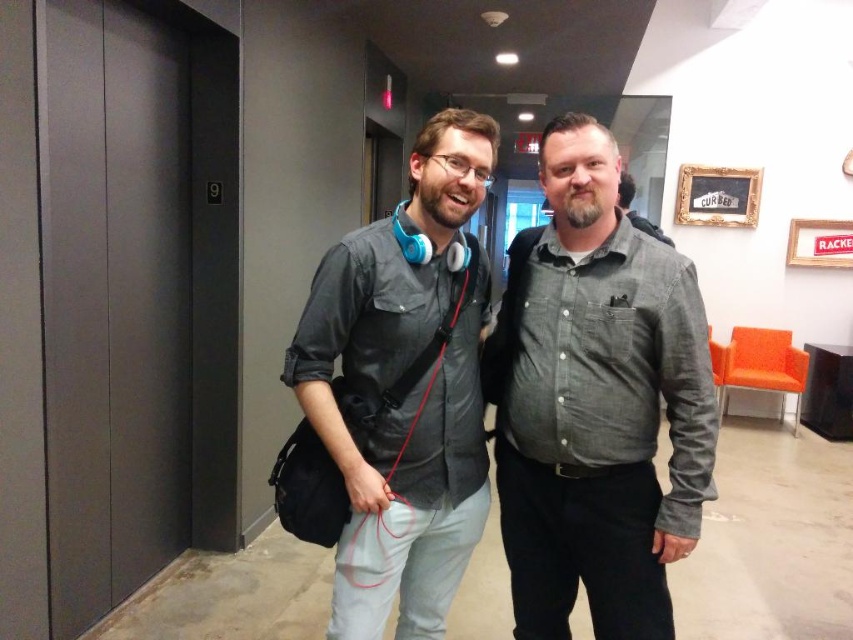
Question: Based on their relative distances, which object is farther from the matte gray elevator at left?

Choices:
 (A) matte gray shirt at center
 (B) gray cotton shirt at center

Answer: (B)

Question: Does matte gray elevator at left appear on the right side of matte gray shirt at center?

Choices:
 (A) no
 (B) yes

Answer: (A)

Question: Which of the following is the farthest from the observer?

Choices:
 (A) matte gray shirt at center
 (B) gray cotton shirt at center

Answer: (A)

Question: Among these objects, which one is farthest from the camera?

Choices:
 (A) gray cotton shirt at center
 (B) matte gray shirt at center

Answer: (B)

Question: Does gray cotton shirt at center appear under matte gray shirt at center?

Choices:
 (A) yes
 (B) no

Answer: (A)

Question: Is gray cotton shirt at center thinner than matte gray shirt at center?

Choices:
 (A) yes
 (B) no

Answer: (A)